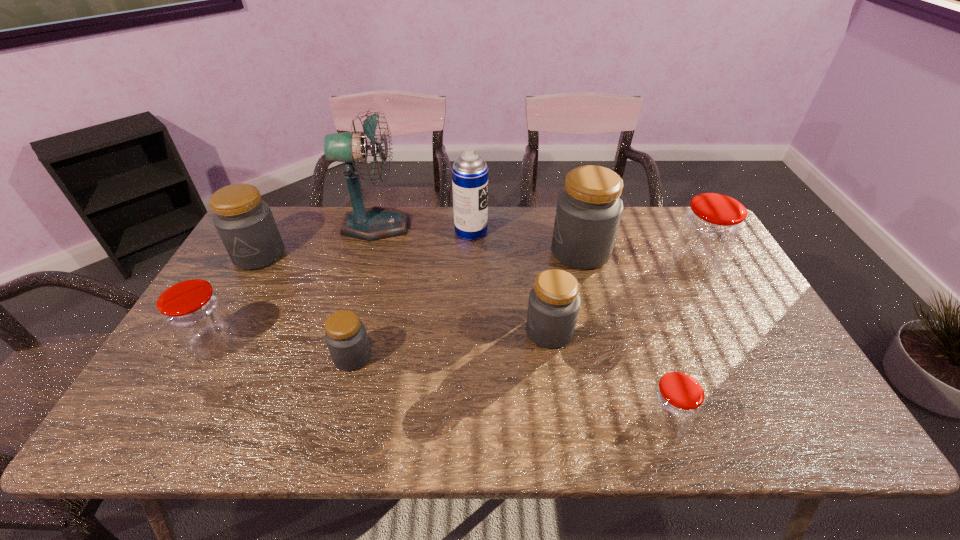
Select which gray jar appears as the second closest to the leftmost gray jar. Please provide its 2D coordinates. Your answer should be formatted as a tuple, i.e. [(x, y)], where the tuple contains the x and y coordinates of a point satisfying the conditions above.

[(554, 302)]

Where is `the third closest gray jar to the second biggest gray jar`? This screenshot has height=540, width=960. the third closest gray jar to the second biggest gray jar is located at coordinates (589, 209).

Where is `red jar that stands as the second closest to the leftmost gray jar`? This screenshot has height=540, width=960. red jar that stands as the second closest to the leftmost gray jar is located at coordinates (676, 400).

Where is `the third closest red jar to the blue aerosol can`? the third closest red jar to the blue aerosol can is located at coordinates (676, 400).

Identify the location of vacant area in the image that satisfies the following two spatial constraints: 1. in front of the fan where the wind blows; 2. on the back side of the rightmost object. (364, 267).

The width and height of the screenshot is (960, 540). Find the location of `vacant region that satisfies the following two spatial constraints: 1. in front of the blue fan where the wind blows; 2. on the surface of the third smallest gray jar near the warning symbol`. vacant region that satisfies the following two spatial constraints: 1. in front of the blue fan where the wind blows; 2. on the surface of the third smallest gray jar near the warning symbol is located at coordinates (368, 255).

The image size is (960, 540). Identify the location of free space that satisfies the following two spatial constraints: 1. on the surface of the biggest red jar near the warning symbol; 2. on the left side of the tallest jar. (585, 267).

Identify the location of vacant space that satisfies the following two spatial constraints: 1. on the front side of the second nearest red jar; 2. on the left side of the nearest object. (171, 423).

Where is `vacant space that satisfies the following two spatial constraints: 1. on the front side of the rightmost jar; 2. on the surface of the third biggest gray jar near the warning symbol`? This screenshot has height=540, width=960. vacant space that satisfies the following two spatial constraints: 1. on the front side of the rightmost jar; 2. on the surface of the third biggest gray jar near the warning symbol is located at coordinates (728, 332).

Image resolution: width=960 pixels, height=540 pixels. Identify the location of free space in the image that satisfies the following two spatial constraints: 1. on the surface of the tallest jar near the warning symbol; 2. on the back side of the farthest red jar. (585, 267).